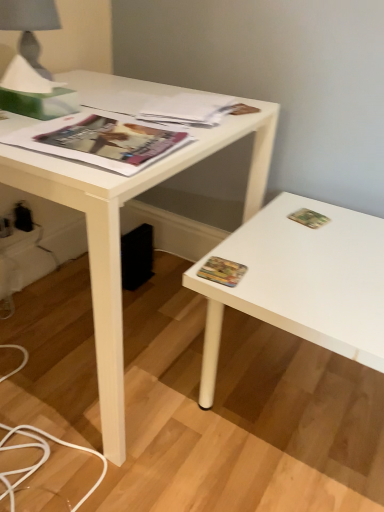
Where is `vacant region under white matte desk at center (from a real-world perspective)`? vacant region under white matte desk at center (from a real-world perspective) is located at coordinates (124, 332).